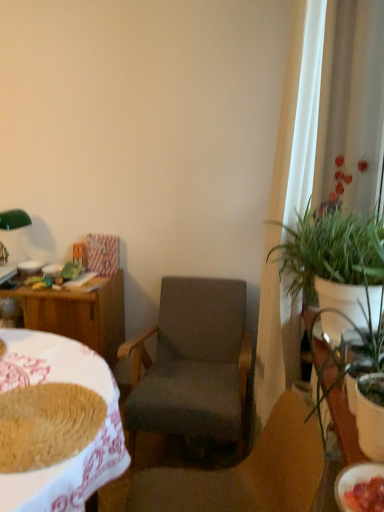
The height and width of the screenshot is (512, 384). Identify the location of free space above wooden desk at left (from a real-world perspective). (48, 382).